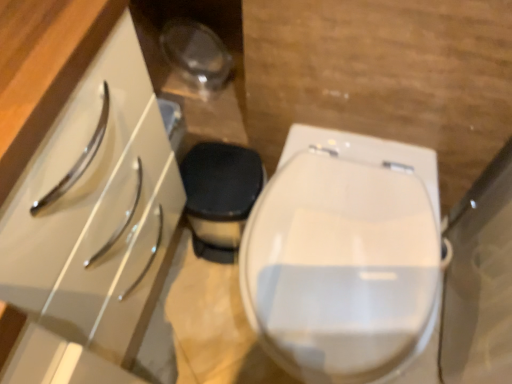
This screenshot has width=512, height=384. Find the location of `empty space that is ontop of white glossy toilet at center (from a real-world perspective)`. empty space that is ontop of white glossy toilet at center (from a real-world perspective) is located at coordinates (340, 248).